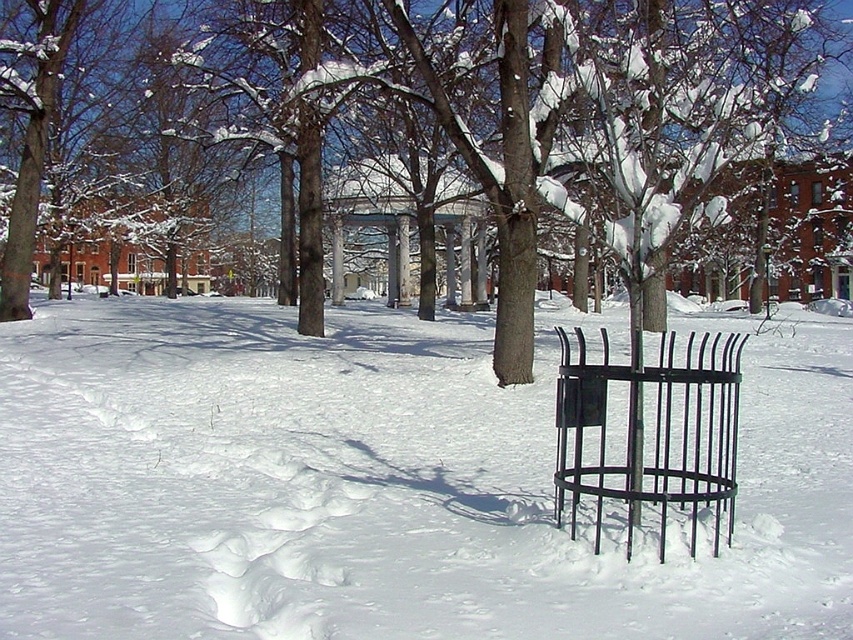
Does white matte snow at center have a lesser width compared to black wrought iron trash can at center?

Incorrect, white matte snow at center's width is not less than black wrought iron trash can at center's.

Can you confirm if white matte snow at center is positioned above black wrought iron trash can at center?

Correct, white matte snow at center is located above black wrought iron trash can at center.

Does point (340, 586) lie in front of point (645, 490)?

Yes, point (340, 586) is closer to viewer.

The width and height of the screenshot is (853, 640). I want to click on white matte snow at center, so click(376, 484).